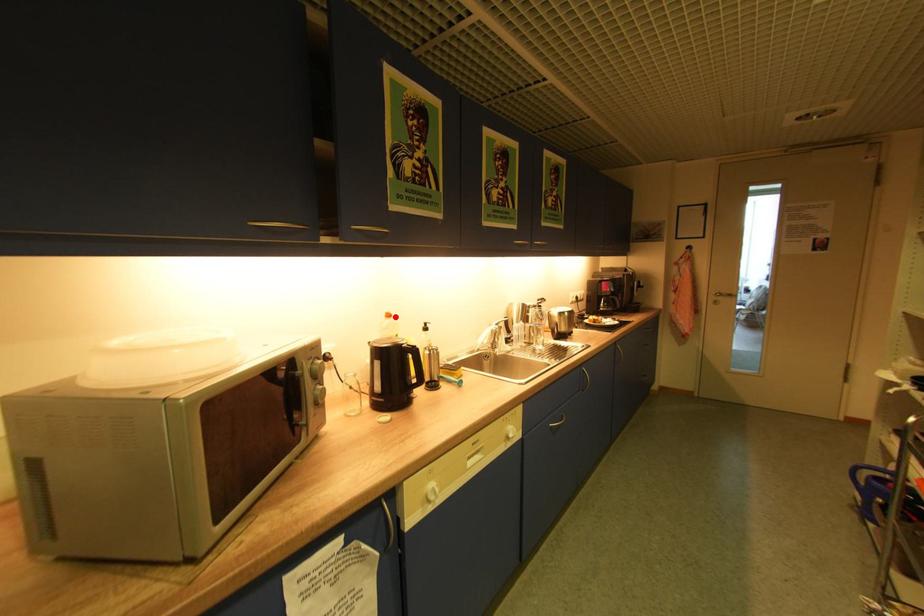
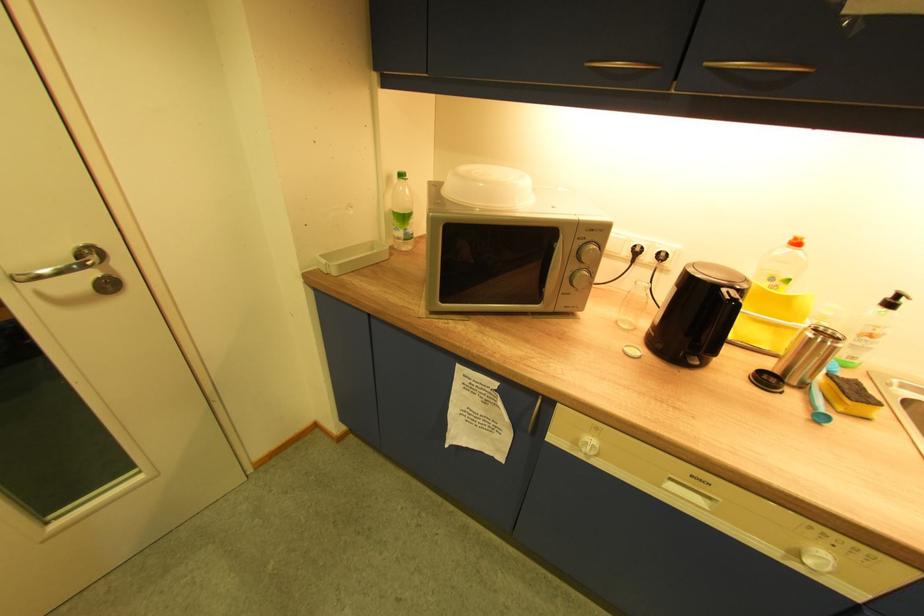
Find the pixel in the second image that matches the highlighted location in the first image.

(803, 244)